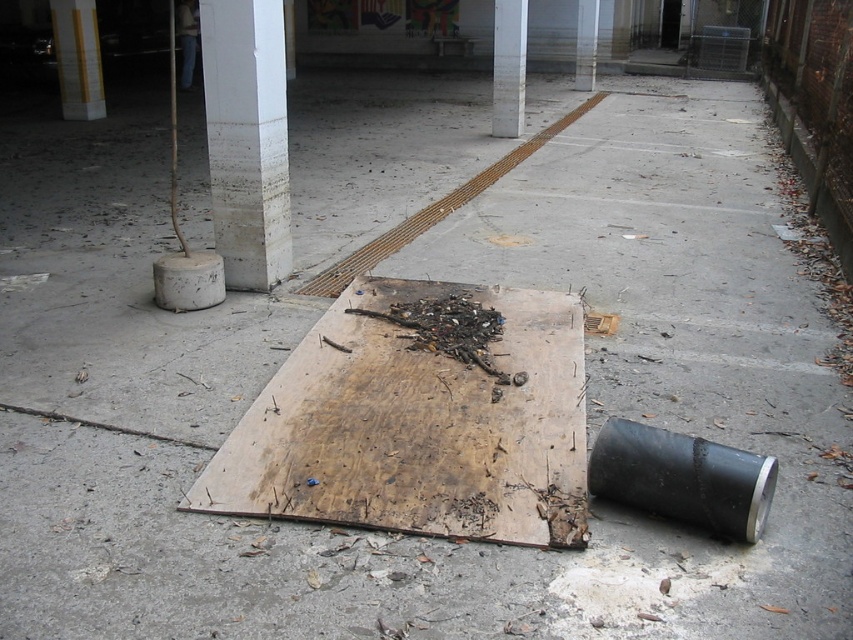
From the picture: Which of these two, charcoal ash at center or yellow painted wood at upper center, stands shorter?

With less height is charcoal ash at center.

Does charcoal ash at center appear under yellow painted wood at upper center?

Yes.

The width and height of the screenshot is (853, 640). In order to click on charcoal ash at center in this screenshot , I will do `click(450, 330)`.

Where is `worn wood board at center`? worn wood board at center is located at coordinates (416, 426).

Who is shorter, worn wood board at center or charcoal ash at center?

charcoal ash at center

The height and width of the screenshot is (640, 853). What do you see at coordinates (416, 426) in the screenshot?
I see `worn wood board at center` at bounding box center [416, 426].

Find the location of `worn wood board at center`. worn wood board at center is located at coordinates (416, 426).

Does worn wood board at center have a greater width compared to yellow painted wood at upper center?

Yes.

I want to click on worn wood board at center, so click(x=416, y=426).

Image resolution: width=853 pixels, height=640 pixels. In order to click on worn wood board at center in this screenshot , I will do `click(416, 426)`.